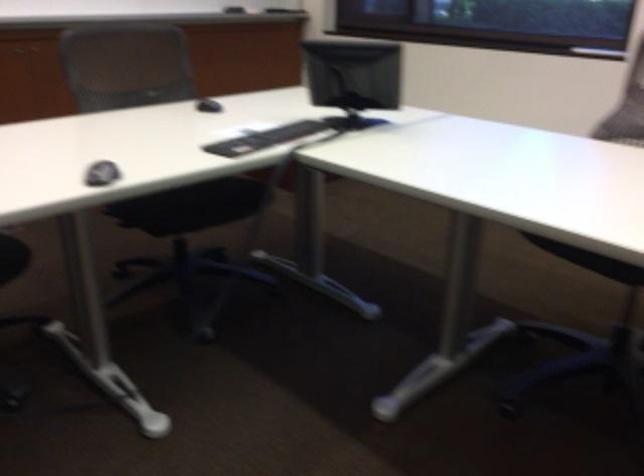
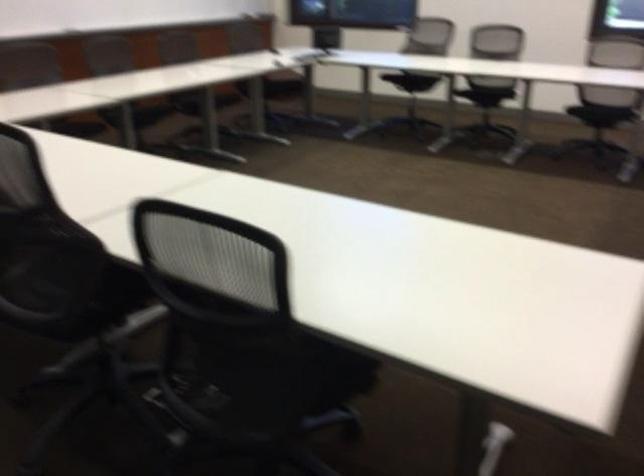
In a continuous first-person perspective shot, in which direction is the camera moving?

The cameraman moved toward left, backward.